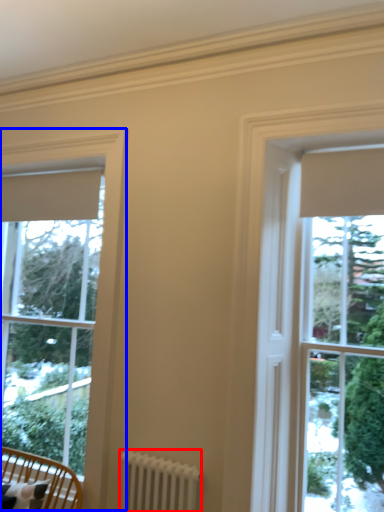
Question: Which of the following is the closest to the observer, radiator (highlighted by a red box) or window (highlighted by a blue box)?

Choices:
 (A) radiator
 (B) window

Answer: (A)